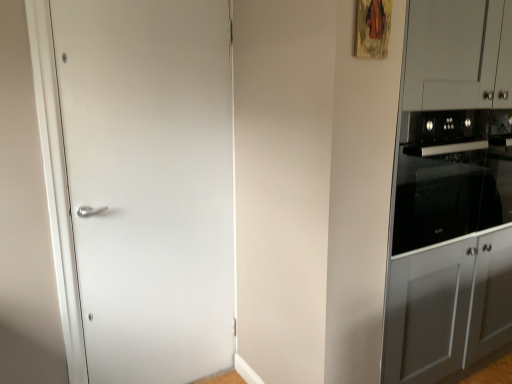
Question: Is black glass oven at right further to the viewer compared to satin gray cabinet at right?

Choices:
 (A) no
 (B) yes

Answer: (B)

Question: Is black glass oven at right oriented away from satin gray cabinet at right?

Choices:
 (A) yes
 (B) no

Answer: (A)

Question: Is black glass oven at right smaller than satin gray cabinet at right?

Choices:
 (A) no
 (B) yes

Answer: (B)

Question: Is black glass oven at right not close to satin gray cabinet at right?

Choices:
 (A) no
 (B) yes

Answer: (A)

Question: Is black glass oven at right shorter than satin gray cabinet at right?

Choices:
 (A) yes
 (B) no

Answer: (A)

Question: Relative to black glass oven at right, is white matte door at left in front or behind?

Choices:
 (A) front
 (B) behind

Answer: (A)

Question: From the image's perspective, relative to black glass oven at right, is white matte door at left above or below?

Choices:
 (A) above
 (B) below

Answer: (B)

Question: In terms of height, does white matte door at left look taller or shorter compared to black glass oven at right?

Choices:
 (A) tall
 (B) short

Answer: (A)

Question: Based on their sizes in the image, would you say white matte door at left is bigger or smaller than black glass oven at right?

Choices:
 (A) big
 (B) small

Answer: (B)

Question: Would you say black glass oven at right is to the left or to the right of white matte door at left in the picture?

Choices:
 (A) right
 (B) left

Answer: (A)

Question: Looking at their shapes, would you say black glass oven at right is wider or thinner than white matte door at left?

Choices:
 (A) thin
 (B) wide

Answer: (B)

Question: In terms of height, does black glass oven at right look taller or shorter compared to white matte door at left?

Choices:
 (A) short
 (B) tall

Answer: (A)

Question: Is black glass oven at right inside or outside of white matte door at left?

Choices:
 (A) inside
 (B) outside

Answer: (B)

Question: Is black glass oven at right inside the boundaries of satin gray cabinet at right, or outside?

Choices:
 (A) inside
 (B) outside

Answer: (A)

Question: Considering the positions of black glass oven at right and satin gray cabinet at right in the image, is black glass oven at right wider or thinner than satin gray cabinet at right?

Choices:
 (A) wide
 (B) thin

Answer: (B)